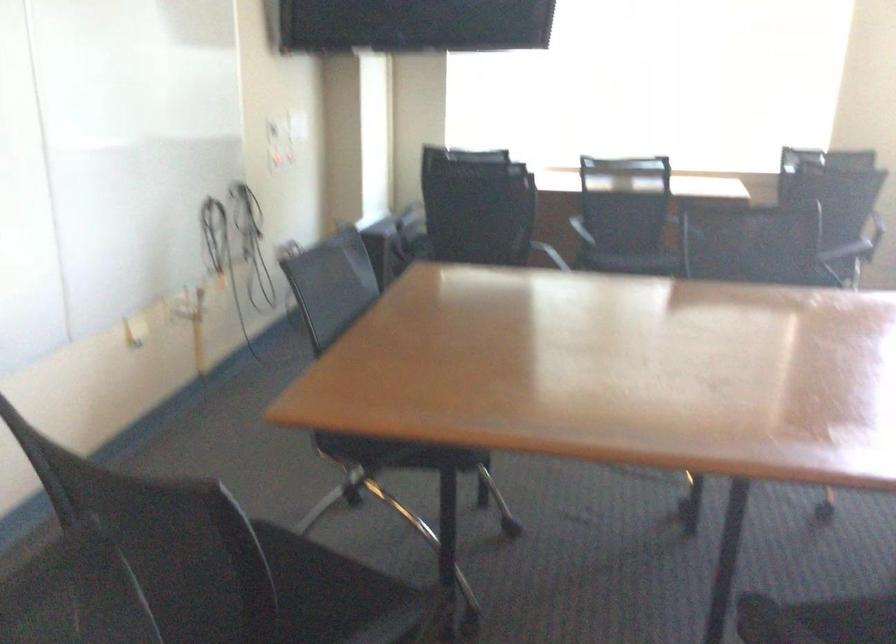
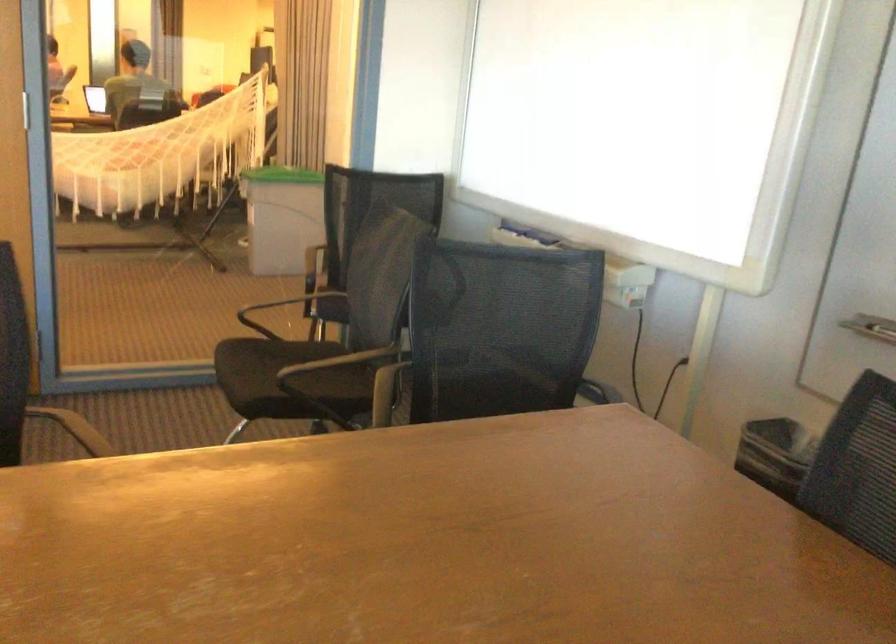
Locate, in the second image, the point that corresponds to point 148,554 in the first image.

(501, 328)